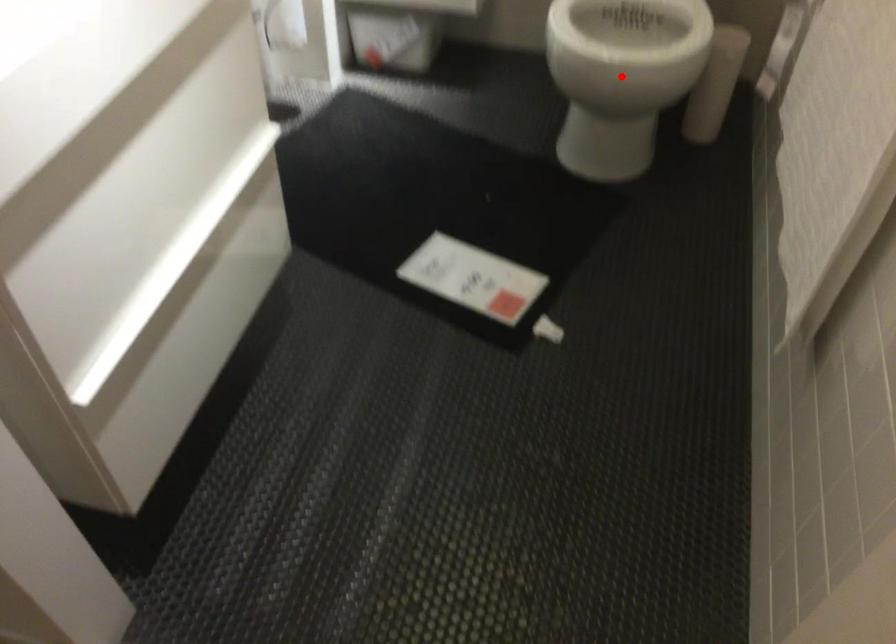
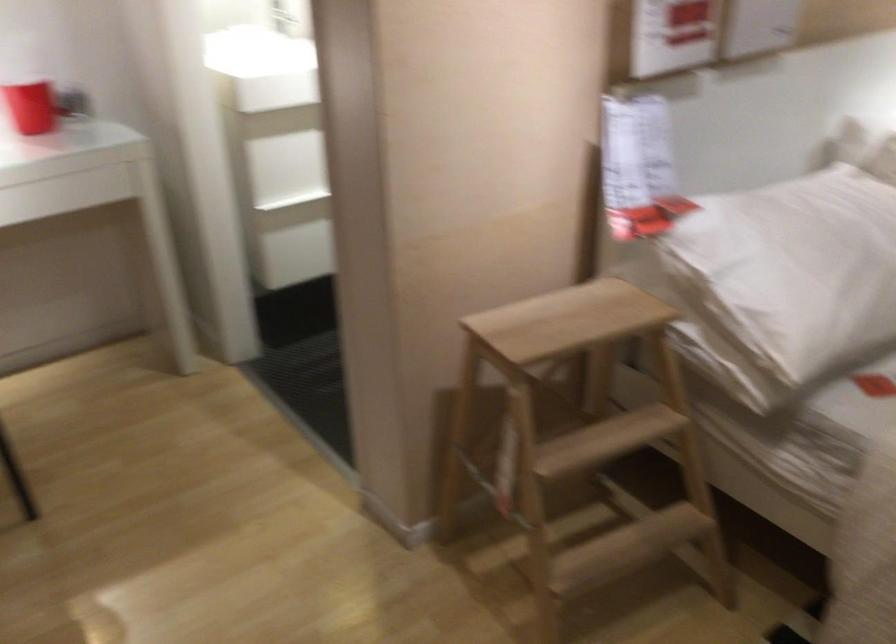
Question: I am providing you with two images of the same scene from different viewpoints. A red point is marked on the first image. At the location where the point appears in image 1, is it still visible in image 2?

Choices:
 (A) Yes
 (B) No

Answer: (B)